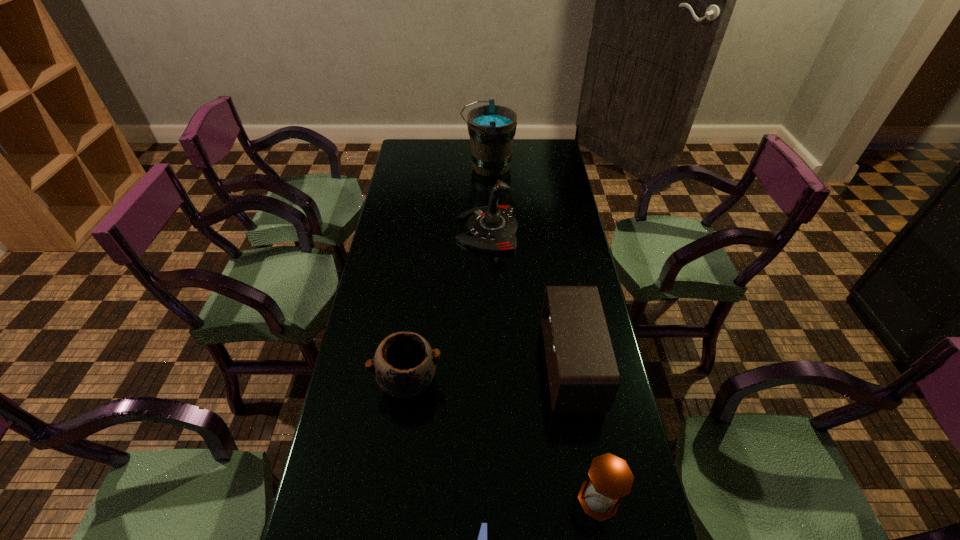
Where is `wine bucket`? This screenshot has height=540, width=960. wine bucket is located at coordinates (491, 128).

Where is `the tallest object`? This screenshot has width=960, height=540. the tallest object is located at coordinates (491, 128).

What are the coordinates of `the fifth nearest object` in the screenshot? It's located at (493, 228).

Locate an element on the screen. The height and width of the screenshot is (540, 960). joystick is located at coordinates (493, 228).

Locate an element on the screen. Image resolution: width=960 pixels, height=540 pixels. radio receiver is located at coordinates (583, 376).

I want to click on pottery, so click(x=404, y=364).

Locate an element on the screen. The height and width of the screenshot is (540, 960). the fifth farthest object is located at coordinates (610, 478).

You are a GUI agent. You are given a task and a screenshot of the screen. Output one action in this format:
    pyautogui.click(x=<x>, y=<y>)
    Task: Click on the free spot located 0.060m with a handle on the side of the tallest object
    
    Given the screenshot: What is the action you would take?
    pyautogui.click(x=448, y=166)

I want to click on vacant space located 0.090m with a handle on the side of the tallest object, so click(x=442, y=166).

Where is `vacant space located with a handle on the side of the tallest object`? This screenshot has width=960, height=540. vacant space located with a handle on the side of the tallest object is located at coordinates (397, 166).